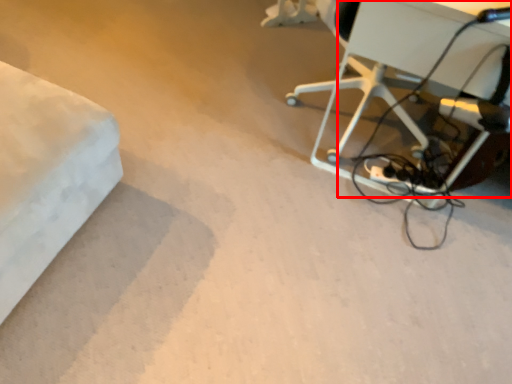
Question: Considering the relative positions of table (annotated by the red box) and extension cord in the image provided, where is table (annotated by the red box) located with respect to the staircase?

Choices:
 (A) left
 (B) right

Answer: (B)